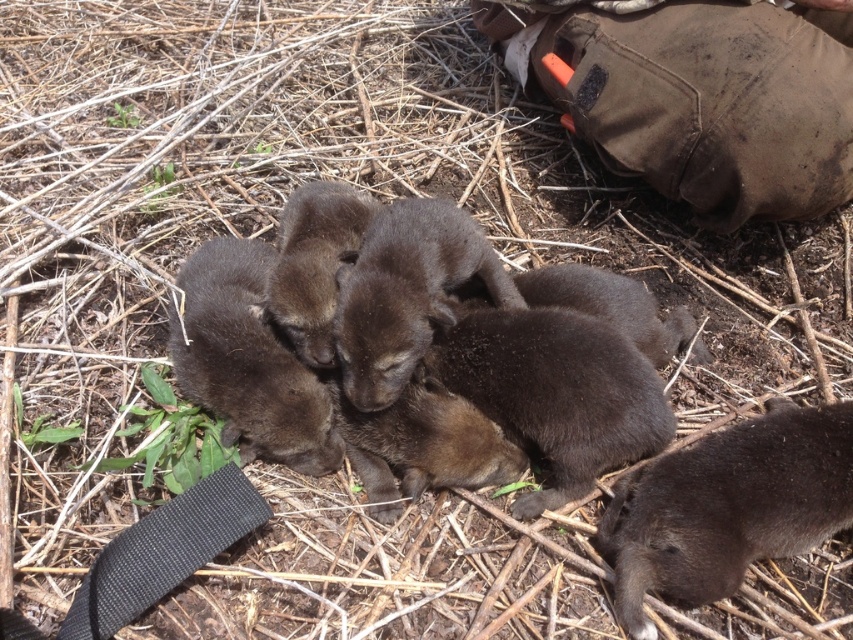
You are a puppy in the image and you want to reach the brown canvas pants at upper right from the brown fur at lower right. Can you do it without moving more than 28 inches?

The brown canvas pants at upper right and brown fur at lower right are 29.33 inches apart, so the puppy cannot reach them without moving more than 28 inches.